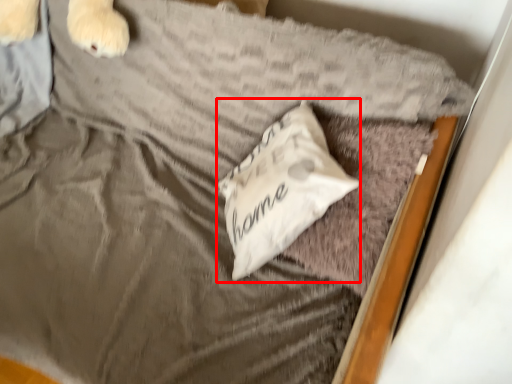
Question: Considering the relative positions of pillow (annotated by the red box) and pillow in the image provided, where is pillow (annotated by the red box) located with respect to the staircase?

Choices:
 (A) left
 (B) right

Answer: (A)